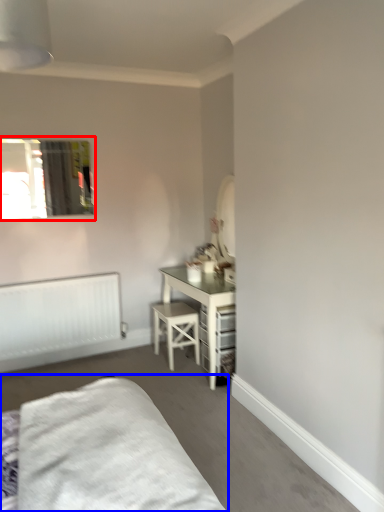
Question: Which object appears closest to the camera in this image, window (highlighted by a red box) or bed (highlighted by a blue box)?

Choices:
 (A) window
 (B) bed

Answer: (B)